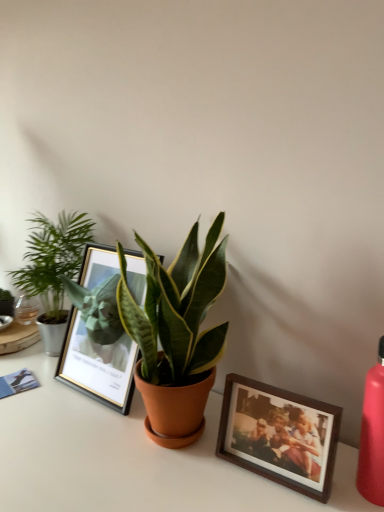
Locate an element on the screen. free space between green glossy houseplant at center, which appears as the 2th houseplant when viewed from the back, and metallic gold picture frame at center, positioned as the first picture frame in left-to-right order is located at coordinates (83, 409).